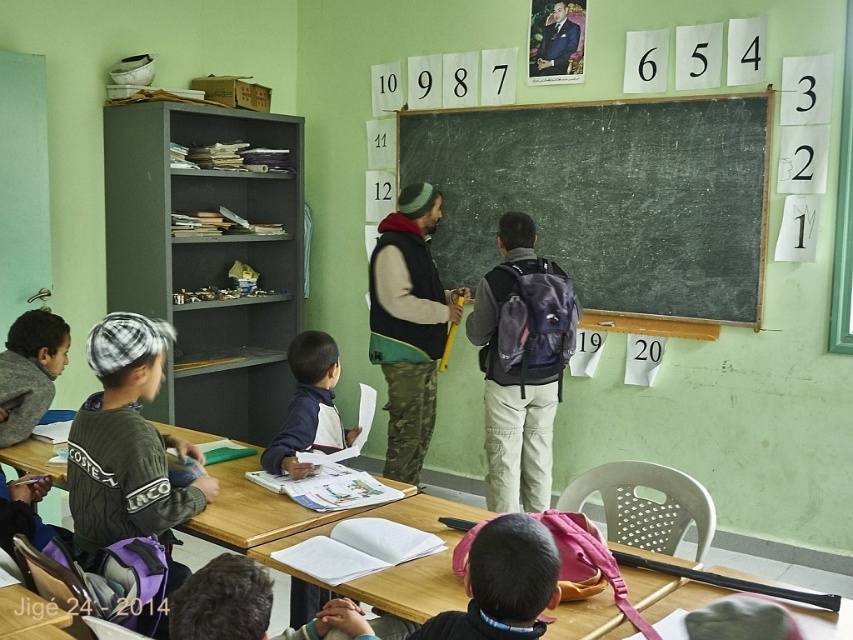
Question: Does black chalkboard at center lie behind navy blue jacket at center?

Choices:
 (A) yes
 (B) no

Answer: (A)

Question: Is camo fabric vest at center further to camera compared to wooden table at lower left?

Choices:
 (A) no
 (B) yes

Answer: (B)

Question: Among these points, which one is nearest to the camera?

Choices:
 (A) (74, 522)
 (B) (317, 406)
 (C) (0, 460)
 (D) (482, 600)

Answer: (D)

Question: Observing the image, what is the correct spatial positioning of wooden desk at center in reference to black matte backpack at center?

Choices:
 (A) right
 (B) left

Answer: (B)

Question: Which point is closer to the camera?

Choices:
 (A) wooden table at lower left
 (B) matte gray backpack at center
 (C) wooden table at center
 (D) navy blue jacket at center

Answer: (C)

Question: Estimate the real-world distances between objects in this image. Which object is farther from the black matte backpack at center?

Choices:
 (A) matte gray backpack at center
 (B) navy blue jacket at center
 (C) camo fabric vest at center
 (D) black chalkboard at center

Answer: (D)